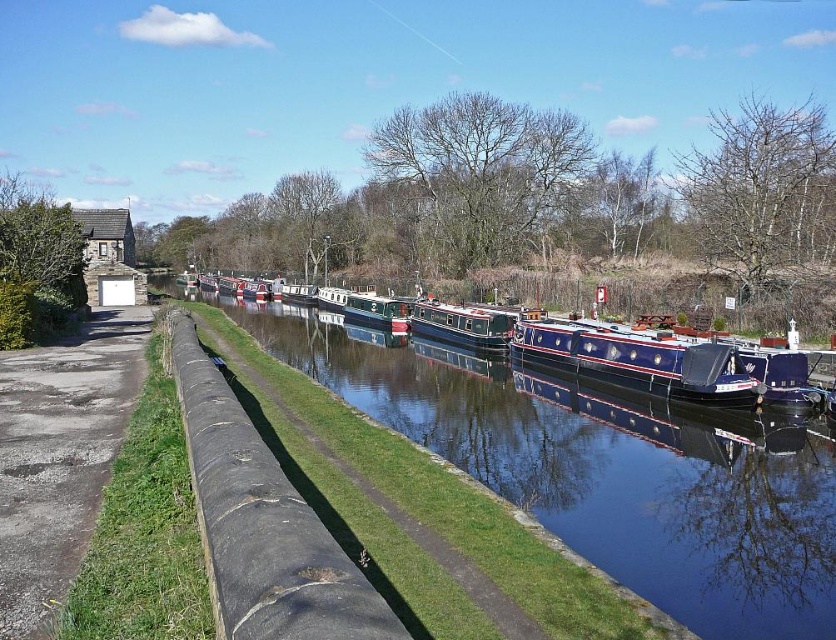
Question: Which point appears farthest from the camera in this image?

Choices:
 (A) (447, 317)
 (B) (287, 298)

Answer: (B)

Question: Which point is farther from the camera taking this photo?

Choices:
 (A) (350, 320)
 (B) (296, 291)
 (C) (19, 596)
 (D) (352, 330)

Answer: (B)

Question: Does blue polished wood barge at center appear under green glossy canal boat at center?

Choices:
 (A) no
 (B) yes

Answer: (B)

Question: Which object is positioned farthest from the rough concrete wall at lower left?

Choices:
 (A) green polished wooden boat at center
 (B) blue polished wood canal at center
 (C) porous concrete path at left
 (D) blue polished wooden boat at center

Answer: (A)

Question: Is blue polished wood canal at center bigger than rough concrete wall at lower left?

Choices:
 (A) no
 (B) yes

Answer: (B)

Question: Can you confirm if rough concrete wall at lower left is bigger than porous concrete path at left?

Choices:
 (A) no
 (B) yes

Answer: (A)